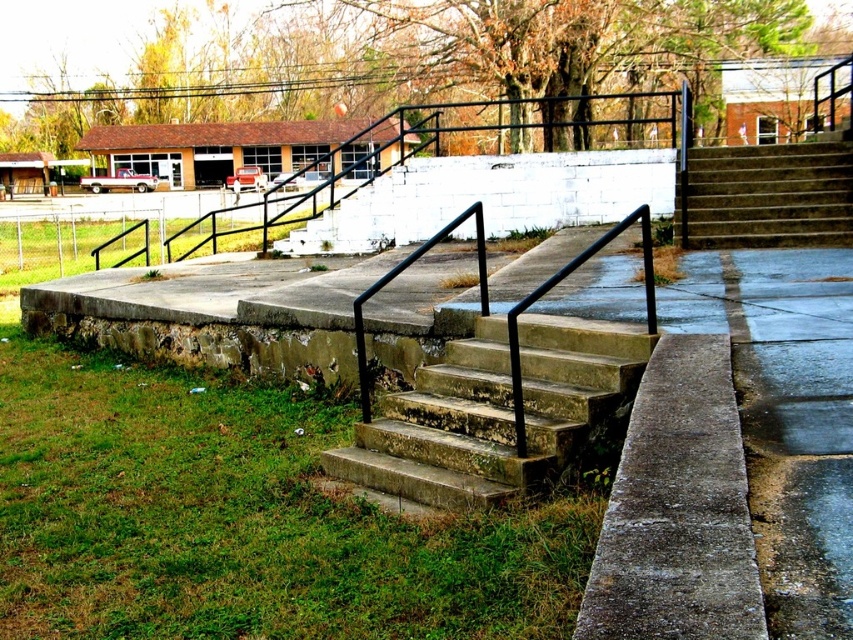
Which of these two, black metal railing at upper center or brown concrete stairs at upper right, stands shorter?

Standing shorter between the two is brown concrete stairs at upper right.

Is point (357, 148) behind point (820, 179)?

Yes, it is.

The image size is (853, 640). In order to click on black metal railing at upper center in this screenshot , I will do `click(433, 170)`.

Where is `black metal railing at upper center`? This screenshot has width=853, height=640. black metal railing at upper center is located at coordinates (433, 170).

Which is more to the left, green grass at lower left or concrete steps at center?

Positioned to the left is green grass at lower left.

Measure the distance from green grass at lower left to concrete steps at center.

3.76 feet

The image size is (853, 640). Describe the element at coordinates (242, 516) in the screenshot. I see `green grass at lower left` at that location.

Locate an element on the screen. The width and height of the screenshot is (853, 640). green grass at lower left is located at coordinates (242, 516).